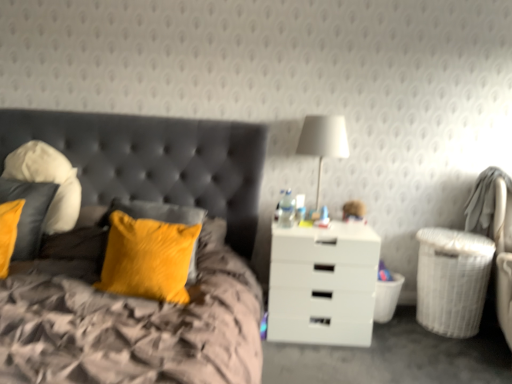
Question: Should I look upward or downward to see white wicker laundry basket at lower right, positioned as the 2th laundry basket in left-to-right order?

Choices:
 (A) up
 (B) down

Answer: (B)

Question: Does white wicker laundry basket at right, placed as the first laundry basket when sorted from left to right, have a lesser width compared to white wicker laundry basket at lower right, positioned as the 2th laundry basket in left-to-right order?

Choices:
 (A) no
 (B) yes

Answer: (B)

Question: Is white wicker laundry basket at right, placed as the first laundry basket when sorted from left to right, bigger than white wicker laundry basket at lower right, positioned as the 2th laundry basket in left-to-right order?

Choices:
 (A) yes
 (B) no

Answer: (B)

Question: Is white wicker laundry basket at right, placed as the first laundry basket when sorted from left to right, shorter than white wicker laundry basket at lower right, the 1th laundry basket positioned from the right?

Choices:
 (A) no
 (B) yes

Answer: (B)

Question: Is white wicker laundry basket at right, placed as the 2th laundry basket when sorted from right to left, oriented away from white wicker laundry basket at lower right, the 1th laundry basket positioned from the right?

Choices:
 (A) no
 (B) yes

Answer: (A)

Question: From the image's perspective, is white wicker laundry basket at right, placed as the first laundry basket when sorted from left to right, on white wicker laundry basket at lower right, positioned as the 2th laundry basket in left-to-right order?

Choices:
 (A) no
 (B) yes

Answer: (A)

Question: Are white wicker laundry basket at right, placed as the 2th laundry basket when sorted from right to left, and white wicker laundry basket at lower right, the 1th laundry basket positioned from the right, located far from each other?

Choices:
 (A) no
 (B) yes

Answer: (A)

Question: Considering the relative sizes of soft white pillow at left, which is counted as the third pillow, starting from the right, and velvet yellow pillow at left, which is the 2th pillow from right to left, in the image provided, is soft white pillow at left, which is counted as the third pillow, starting from the right, wider than velvet yellow pillow at left, which is the 2th pillow from right to left,?

Choices:
 (A) yes
 (B) no

Answer: (B)

Question: From the image's perspective, is soft white pillow at left, which is counted as the third pillow, starting from the right, below velvet yellow pillow at left, marked as the 2th pillow in a left-to-right arrangement?

Choices:
 (A) yes
 (B) no

Answer: (B)

Question: From a real-world perspective, is soft white pillow at left, the 1th pillow positioned from the left, below velvet yellow pillow at left, which is the 2th pillow from right to left?

Choices:
 (A) no
 (B) yes

Answer: (A)

Question: Is soft white pillow at left, which is counted as the third pillow, starting from the right, beside velvet yellow pillow at left, marked as the 2th pillow in a left-to-right arrangement?

Choices:
 (A) yes
 (B) no

Answer: (B)

Question: Does soft white pillow at left, the 1th pillow positioned from the left, have a lesser width compared to velvet yellow pillow at left, which is the 2th pillow from right to left?

Choices:
 (A) yes
 (B) no

Answer: (A)

Question: Is velvet yellow pillow at left, marked as the 2th pillow in a left-to-right arrangement, completely or partially inside soft white pillow at left, the 1th pillow positioned from the left?

Choices:
 (A) yes
 (B) no

Answer: (B)

Question: Can you confirm if velvet yellow pillow at upper left is wider than velvet yellow pillow at left, marked as the 2th pillow in a left-to-right arrangement?

Choices:
 (A) yes
 (B) no

Answer: (A)